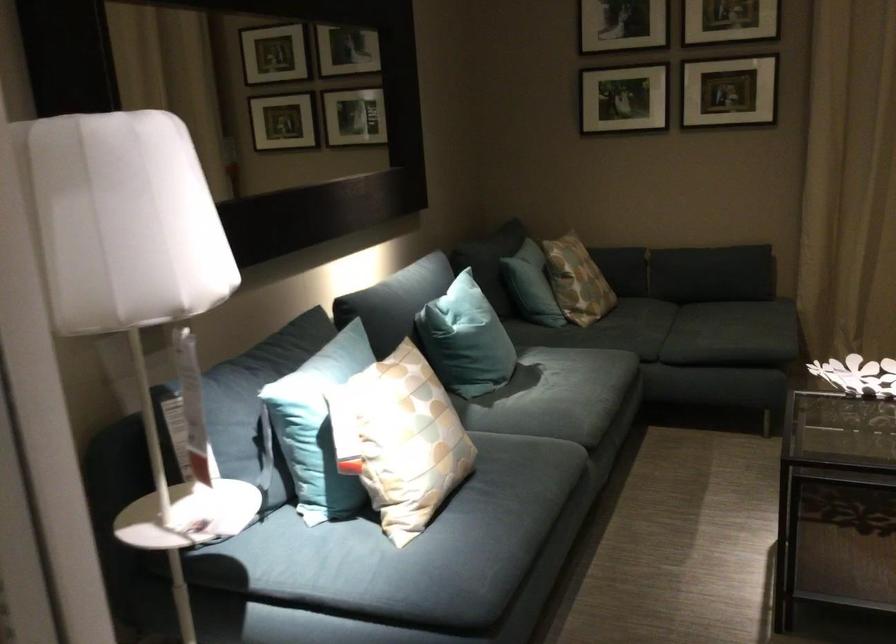
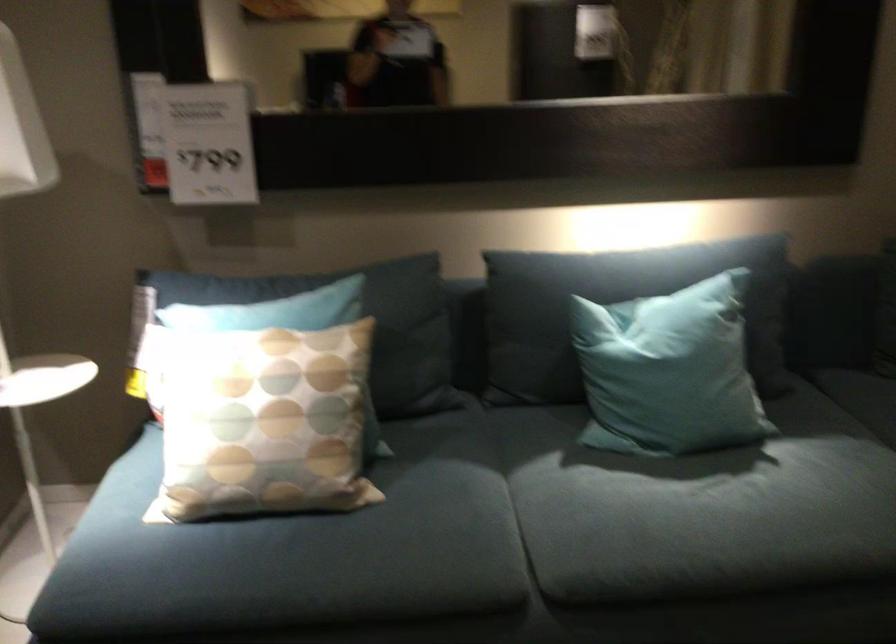
Find the pixel in the second image that matches point (514, 456) in the first image.

(406, 526)